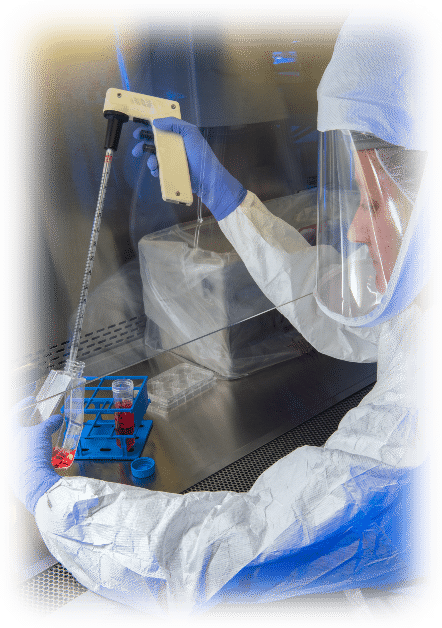
The height and width of the screenshot is (628, 442). Find the location of `grey table`. grey table is located at coordinates (208, 434).